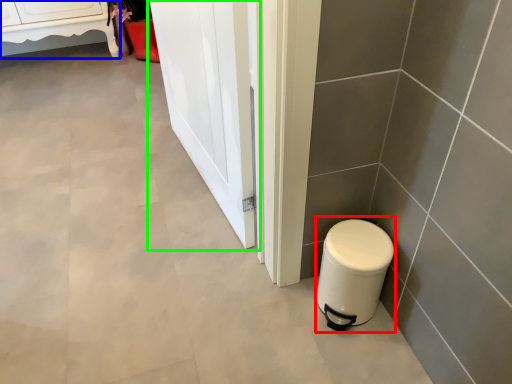
Question: Which object is positioned farthest from appliance (highlighted by a red box)? Select from furniture (highlighted by a blue box) and screen door (highlighted by a green box).

Choices:
 (A) furniture
 (B) screen door

Answer: (A)